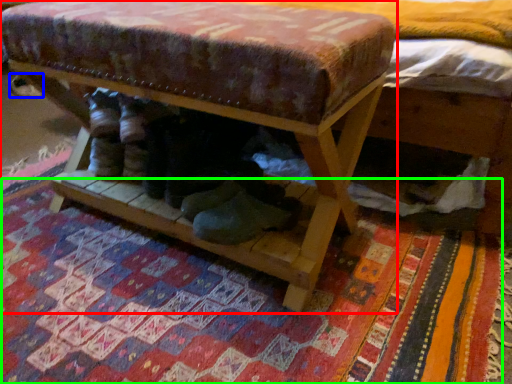
Question: Based on their relative distances, which object is farther from furniture (highlighted by a red box)? Choose from shoe (highlighted by a blue box) and mat (highlighted by a green box).

Choices:
 (A) shoe
 (B) mat

Answer: (A)